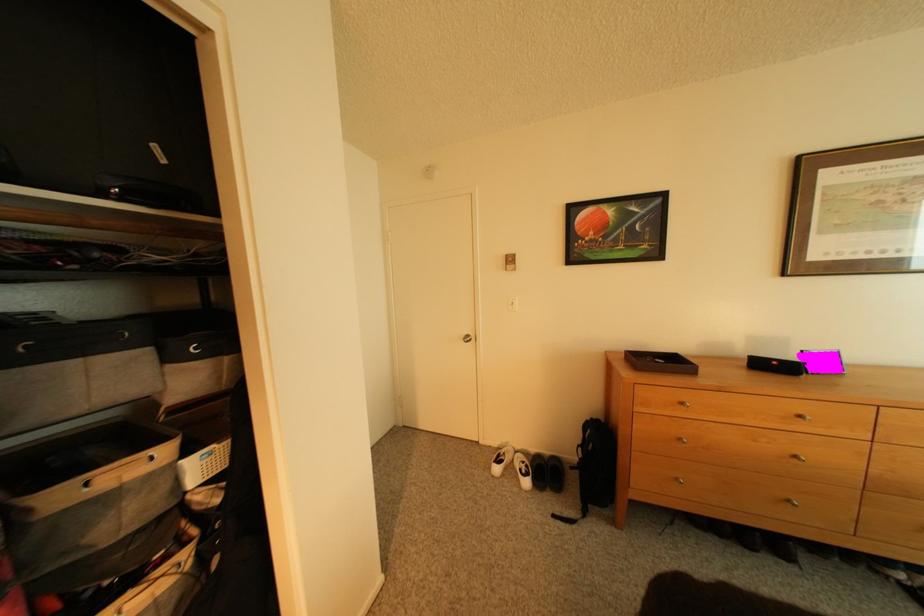
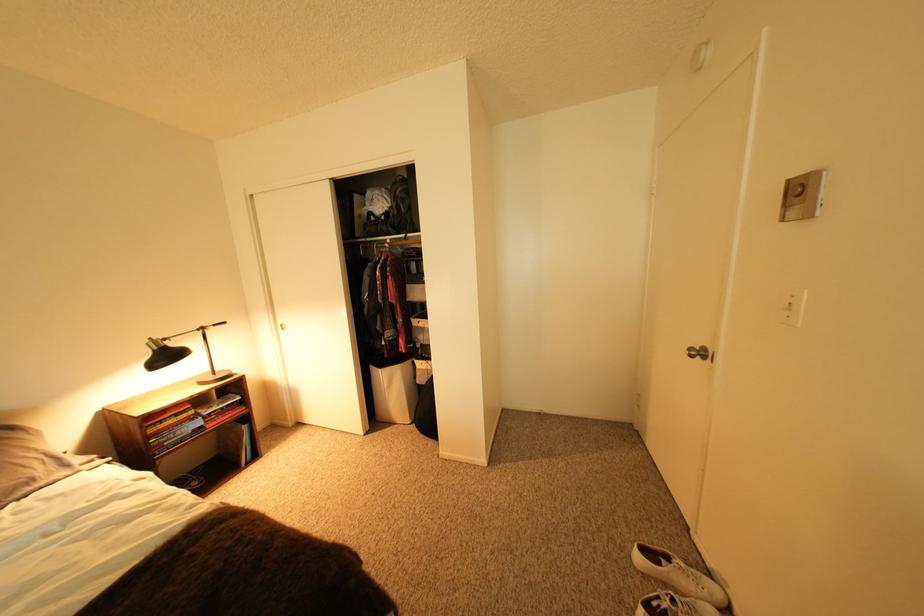
Locate, in the second image, the point that corresponds to [478,339] in the first image.

(703, 351)